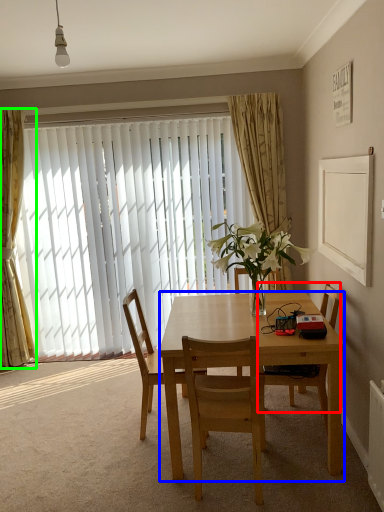
Question: Which object is positioned closest to chair (highlighted by a red box)? Select from desk (highlighted by a blue box) and curtain (highlighted by a green box).

Choices:
 (A) desk
 (B) curtain

Answer: (A)